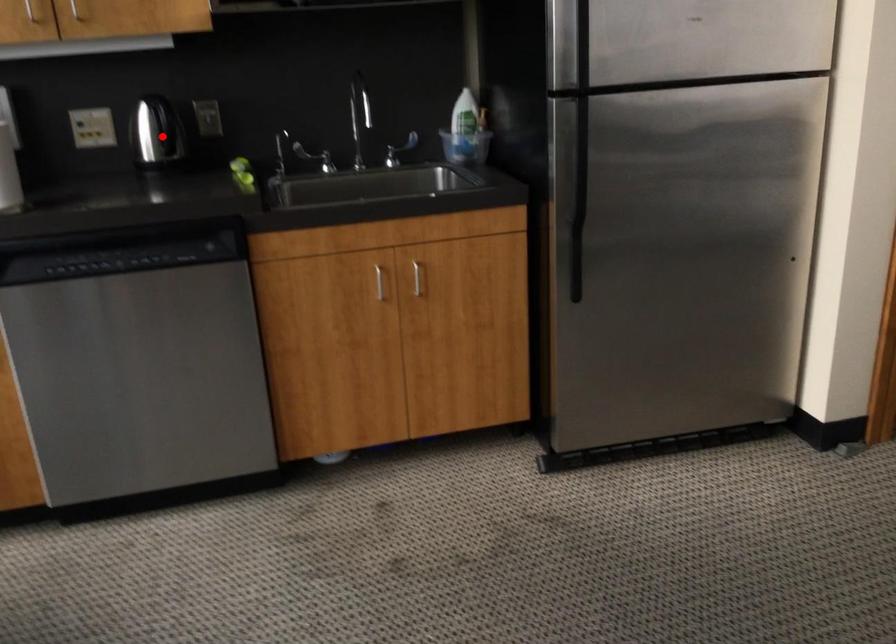
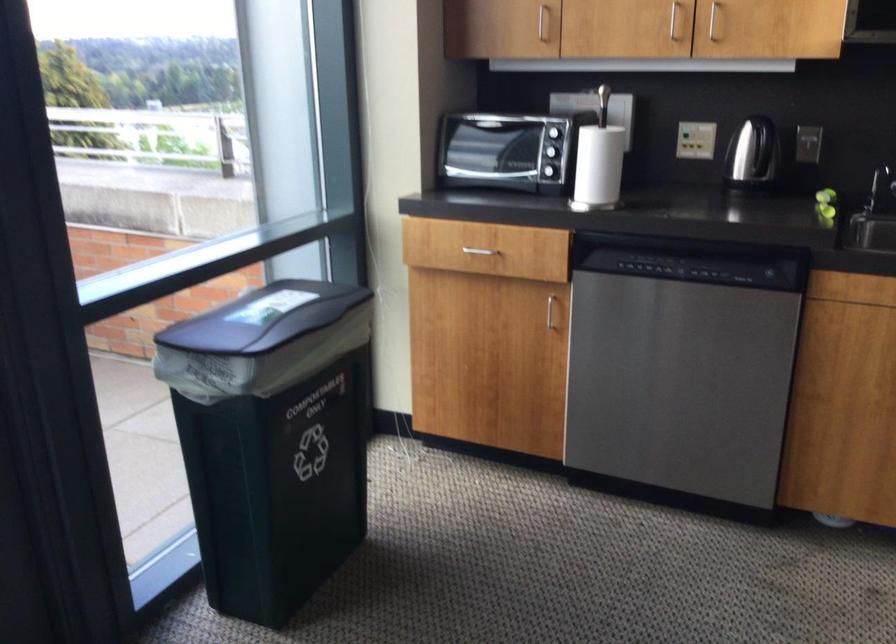
Locate, in the second image, the point that corresponds to the highlighted location in the first image.

(752, 152)